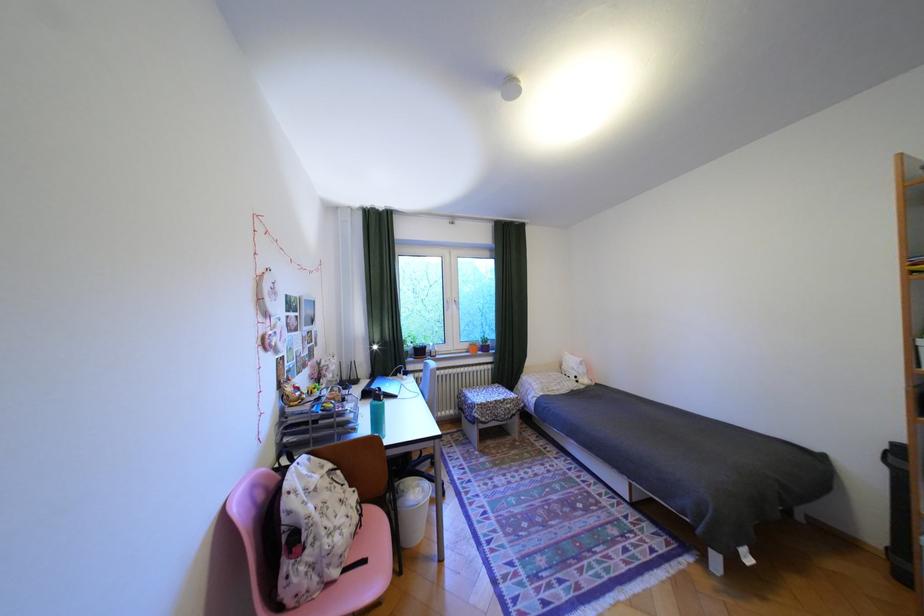
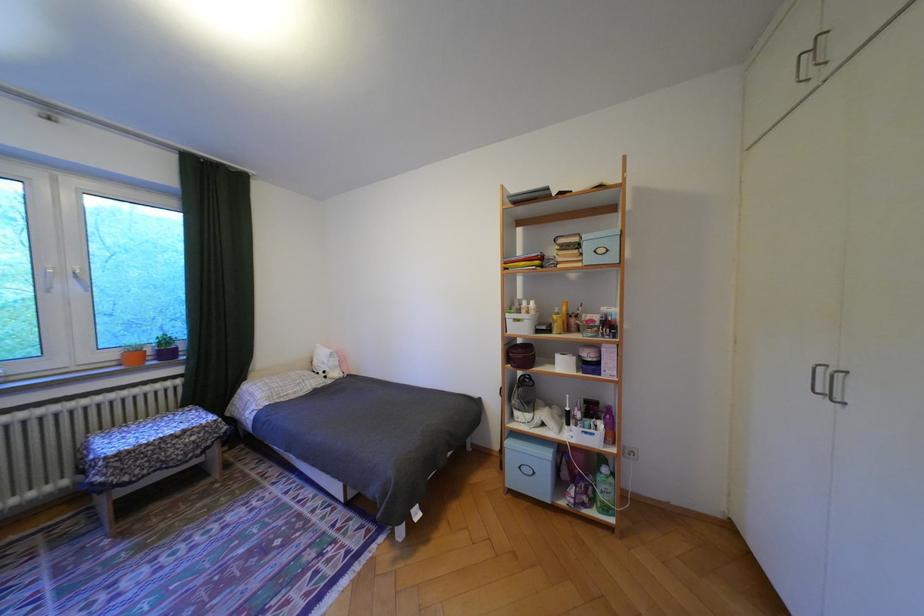
In the second image, find the point that corresponds to point 466,304 in the first image.

(84, 280)